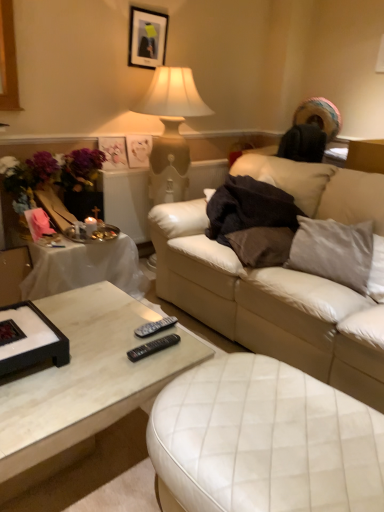
Where is `blank space above white marble coffee table at lower left (from a real-world perspective)`? blank space above white marble coffee table at lower left (from a real-world perspective) is located at coordinates (87, 346).